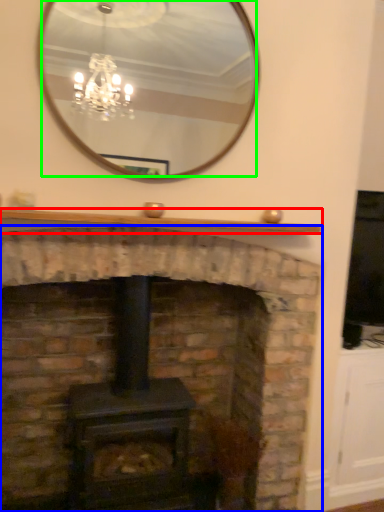
Question: Which object is positioned farthest from mantle (highlighted by a red box)? Select from fireplace (highlighted by a blue box) and mirror (highlighted by a green box).

Choices:
 (A) fireplace
 (B) mirror

Answer: (B)